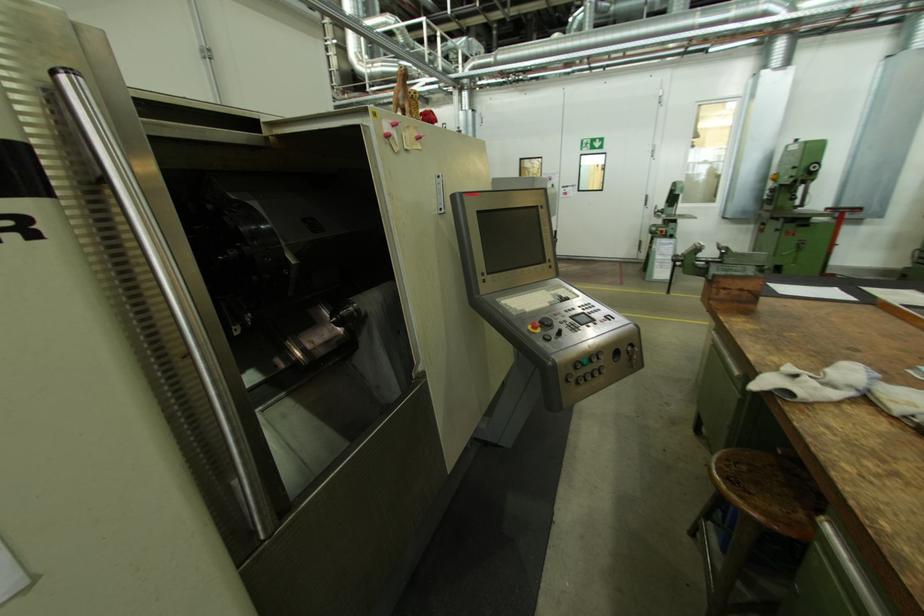
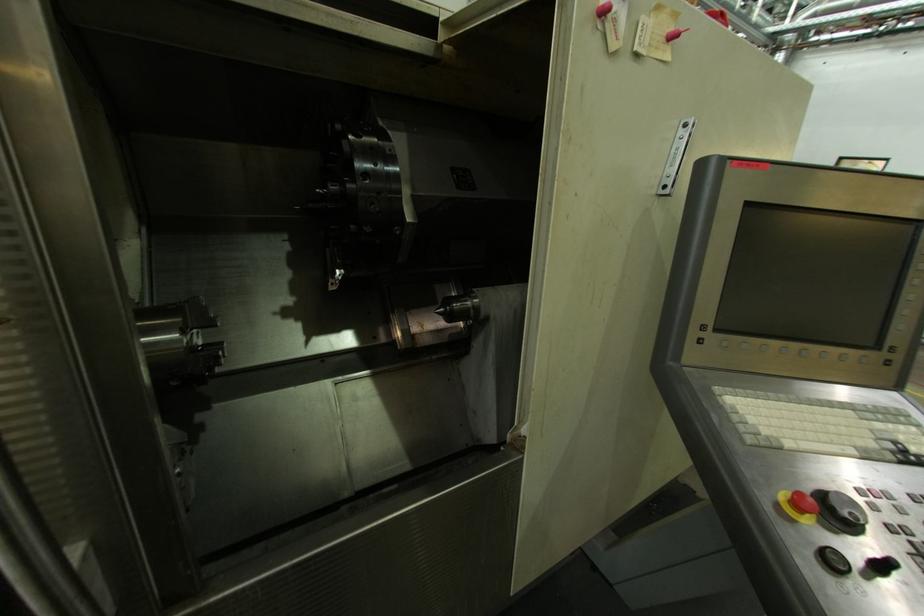
Locate, in the second image, the point that corresponds to (392,134) in the first image.

(608, 7)